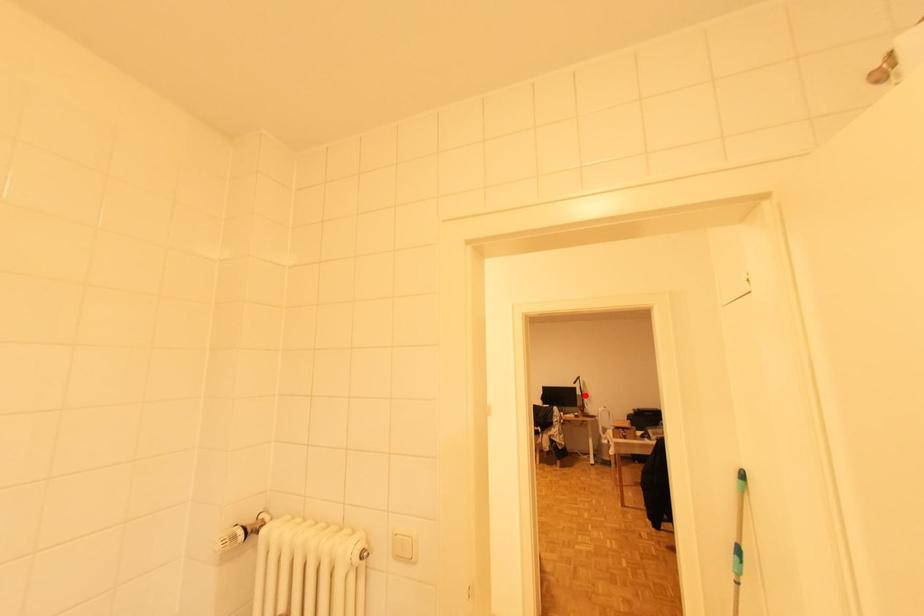
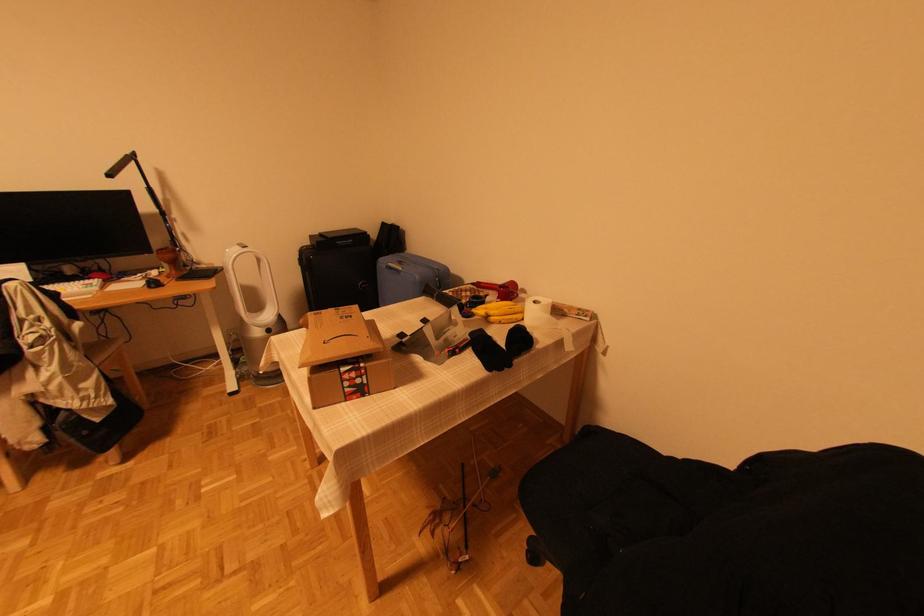
Where in the second image is the point corresponding to the highlighted location from the first image?

(166, 215)